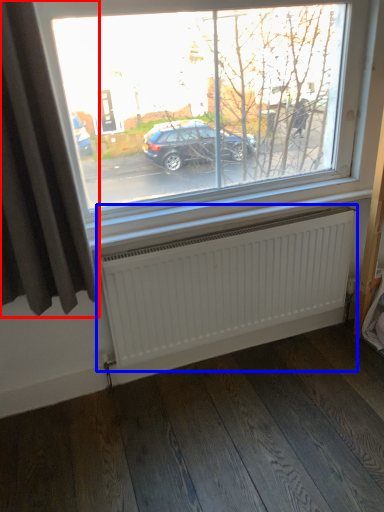
Question: Which of the following is the closest to the observer, curtain (highlighted by a red box) or radiator (highlighted by a blue box)?

Choices:
 (A) curtain
 (B) radiator

Answer: (A)